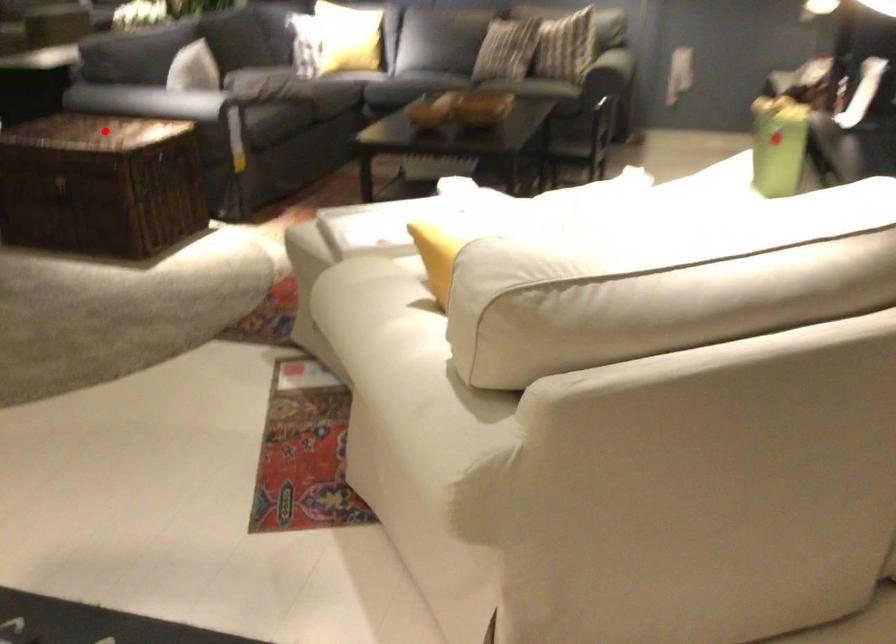
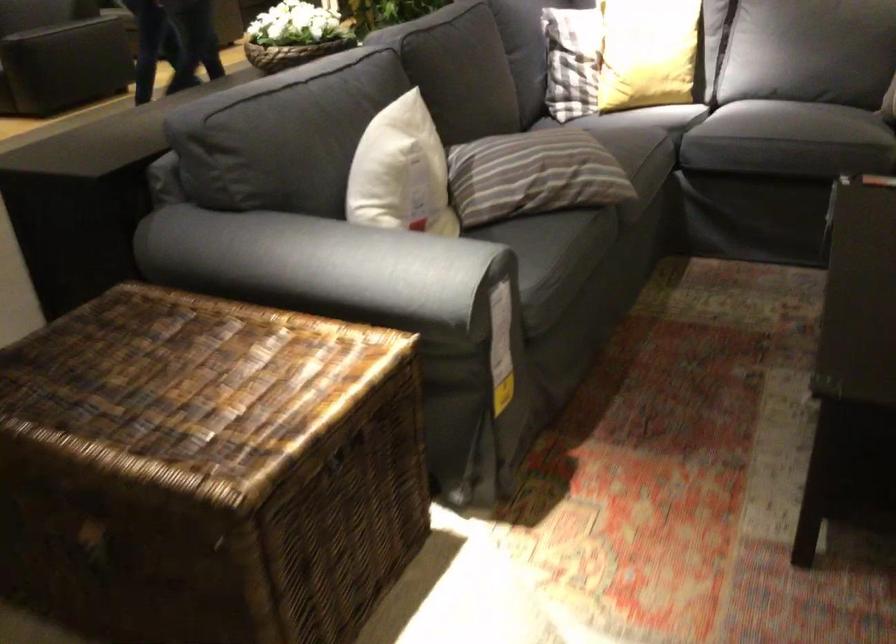
Find the pixel in the second image that matches the highlighted location in the first image.

(195, 389)